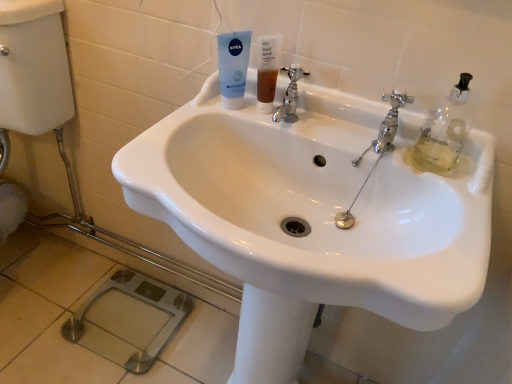
Question: Does chrome metallic faucet at center, which is the 2th tap in right-to-left order, lie in front of white glossy sink at center?

Choices:
 (A) yes
 (B) no

Answer: (B)

Question: Is chrome metallic faucet at center, which ranks as the 1th tap in left-to-right order, outside of white glossy sink at center?

Choices:
 (A) no
 (B) yes

Answer: (A)

Question: Considering the relative positions of chrome metallic faucet at center, which ranks as the 1th tap in left-to-right order, and white glossy sink at center in the image provided, is chrome metallic faucet at center, which ranks as the 1th tap in left-to-right order, behind white glossy sink at center?

Choices:
 (A) no
 (B) yes

Answer: (B)

Question: From the image's perspective, is chrome metallic faucet at center, which is the 2th tap in right-to-left order, under white glossy sink at center?

Choices:
 (A) yes
 (B) no

Answer: (B)

Question: Is chrome metallic faucet at center, which ranks as the 1th tap in left-to-right order, oriented away from white glossy sink at center?

Choices:
 (A) no
 (B) yes

Answer: (A)

Question: Is translucent amber liquid at sink center in front of or behind chrome metallic faucet at upper right, the first tap from the right, in the image?

Choices:
 (A) front
 (B) behind

Answer: (B)

Question: Considering the positions of translucent amber liquid at sink center and chrome metallic faucet at upper right, the first tap from the right, in the image, is translucent amber liquid at sink center taller or shorter than chrome metallic faucet at upper right, the first tap from the right,?

Choices:
 (A) tall
 (B) short

Answer: (B)

Question: Considering the relative positions of translucent amber liquid at sink center and chrome metallic faucet at upper right, the first tap from the right, in the image provided, is translucent amber liquid at sink center to the left or to the right of chrome metallic faucet at upper right, the first tap from the right,?

Choices:
 (A) right
 (B) left

Answer: (B)

Question: Is translucent amber liquid at sink center inside the boundaries of chrome metallic faucet at upper right, the first tap from the right, or outside?

Choices:
 (A) inside
 (B) outside

Answer: (B)

Question: Is point (273, 81) positioned closer to the camera than point (238, 74)?

Choices:
 (A) closer
 (B) farther

Answer: (B)

Question: In the image, is translucent amber liquid at sink center positioned in front of or behind blue matte tube at upper center?

Choices:
 (A) front
 (B) behind

Answer: (B)

Question: Visually, is translucent amber liquid at sink center positioned to the left or to the right of blue matte tube at upper center?

Choices:
 (A) left
 (B) right

Answer: (B)

Question: Is translucent amber liquid at sink center spatially inside blue matte tube at upper center, or outside of it?

Choices:
 (A) outside
 (B) inside

Answer: (A)

Question: From the image's perspective, relative to chrome metallic faucet at upper right, the first tap from the right, is blue matte tube at upper center above or below?

Choices:
 (A) below
 (B) above

Answer: (B)

Question: Looking at their shapes, would you say blue matte tube at upper center is wider or thinner than chrome metallic faucet at upper right, which ranks as the 2th tap in left-to-right order?

Choices:
 (A) thin
 (B) wide

Answer: (B)